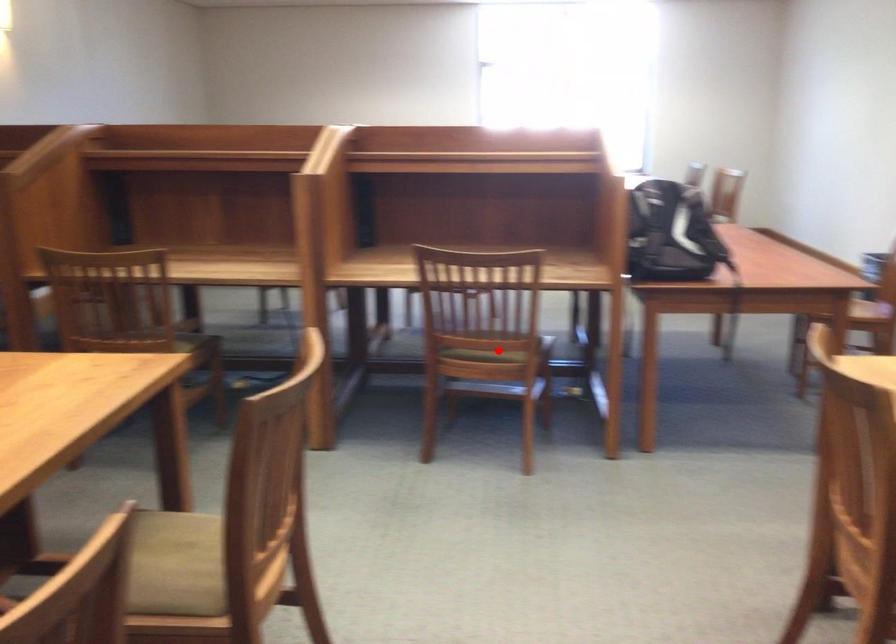
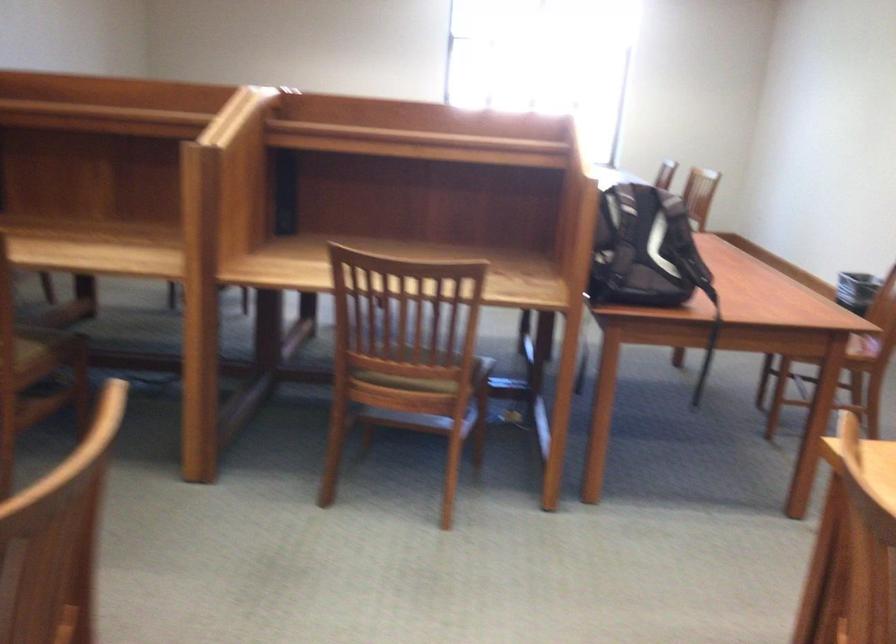
Find the pixel in the second image that matches the highlighted location in the first image.

(421, 379)